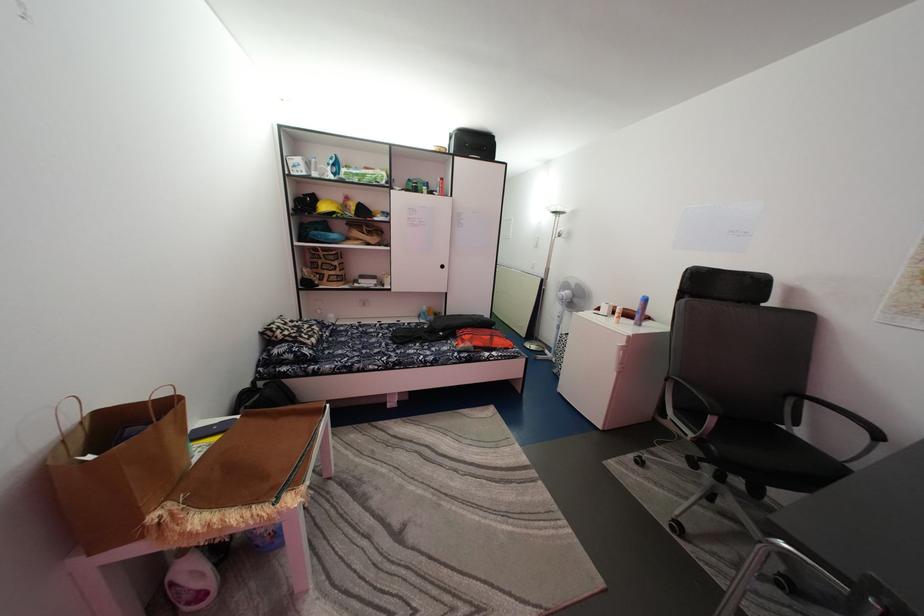
What do you see at coordinates (441, 265) in the screenshot? This screenshot has height=616, width=924. I see `the white cabinet knob` at bounding box center [441, 265].